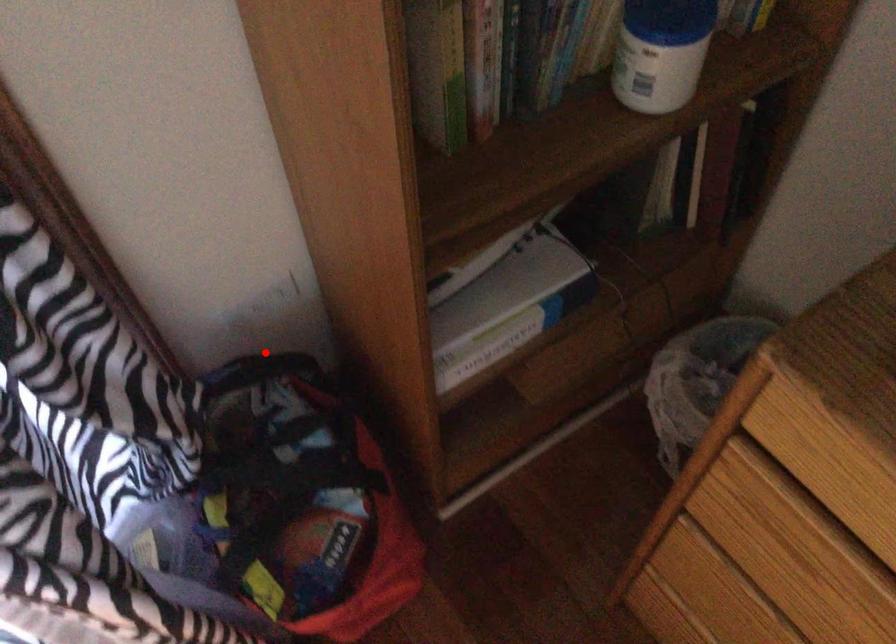
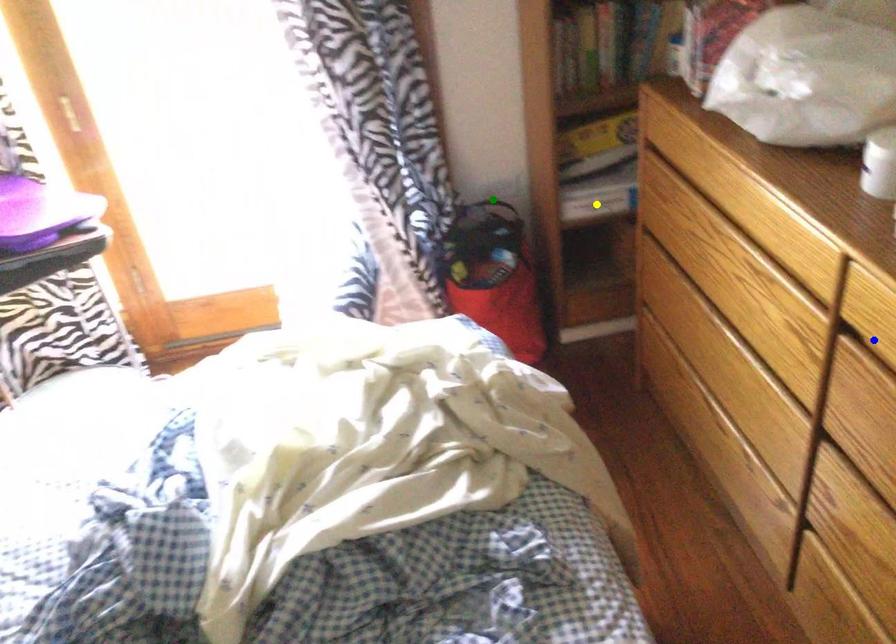
Question: I am providing you with two images of the same scene from different viewpoints. A red point is marked on the first image. You are given multiple points on the second image. Which mark in image 2 goes with the point in image 1?

Choices:
 (A) green point
 (B) blue point
 (C) yellow point

Answer: (A)